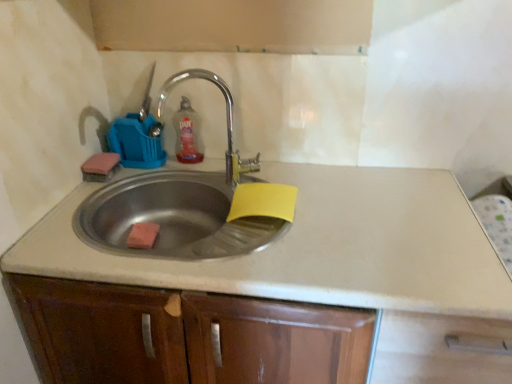
The width and height of the screenshot is (512, 384). I want to click on free spot to the left of translucent plastic bottle at upper center, so click(152, 169).